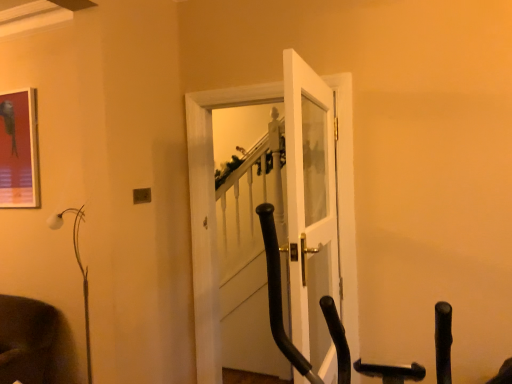
Question: Is metallic glossy picture frame at upper left thinner than white glass door at center, the 2th door viewed from the back?

Choices:
 (A) no
 (B) yes

Answer: (B)

Question: Is metallic glossy picture frame at upper left to the left of white glass door at center, the 2th door viewed from the back, from the viewer's perspective?

Choices:
 (A) yes
 (B) no

Answer: (A)

Question: Does metallic glossy picture frame at upper left come behind white glass door at center, the 1th door positioned from the front?

Choices:
 (A) yes
 (B) no

Answer: (A)

Question: From the image's perspective, is metallic glossy picture frame at upper left below white glass door at center, the 1th door positioned from the front?

Choices:
 (A) yes
 (B) no

Answer: (B)

Question: From the image's perspective, does metallic glossy picture frame at upper left appear higher than white glass door at center, the 2th door viewed from the back?

Choices:
 (A) no
 (B) yes

Answer: (B)

Question: Are metallic glossy picture frame at upper left and white glass door at center, the 1th door positioned from the front, beside each other?

Choices:
 (A) yes
 (B) no

Answer: (B)

Question: Is white glossy door at center, placed as the 1th door when sorted from back to front, positioned in front of white matte floor lamp at left?

Choices:
 (A) yes
 (B) no

Answer: (A)

Question: Are white glossy door at center, which is the 2th door from front to back, and white matte floor lamp at left far apart?

Choices:
 (A) no
 (B) yes

Answer: (A)

Question: Could you tell me if white glossy door at center, which is the 2th door from front to back, is turned towards white matte floor lamp at left?

Choices:
 (A) yes
 (B) no

Answer: (B)

Question: From a real-world perspective, is white glossy door at center, placed as the 1th door when sorted from back to front, on top of white matte floor lamp at left?

Choices:
 (A) yes
 (B) no

Answer: (A)

Question: Is white glossy door at center, which is the 2th door from front to back, thinner than white matte floor lamp at left?

Choices:
 (A) yes
 (B) no

Answer: (A)

Question: Is white glossy door at center, which is the 2th door from front to back, shorter than white matte floor lamp at left?

Choices:
 (A) yes
 (B) no

Answer: (B)

Question: Is metallic glossy picture frame at upper left at the left side of white glossy door at center, placed as the 1th door when sorted from back to front?

Choices:
 (A) no
 (B) yes

Answer: (B)